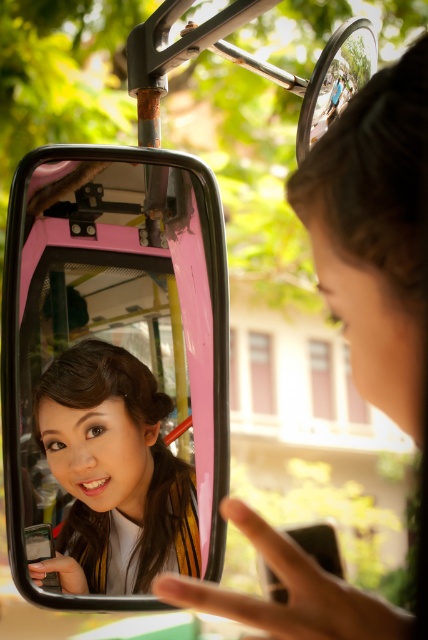
Does pink glossy rearview mirror at upper center have a lesser height compared to matte black hair at center?

No, pink glossy rearview mirror at upper center is not shorter than matte black hair at center.

Is pink glossy rearview mirror at upper center smaller than matte black hair at center?

No, pink glossy rearview mirror at upper center is not smaller than matte black hair at center.

Is point (130, 548) positioned after point (104, 385)?

Yes, it is behind point (104, 385).

Find the location of a particular element. pink glossy rearview mirror at upper center is located at coordinates (112, 372).

Does pink glossy rearview mirror at upper center come behind matte black phone at center?

Yes, pink glossy rearview mirror at upper center is further from the viewer.

Is pink glossy rearview mirror at upper center below matte black phone at center?

Yes.

This screenshot has height=640, width=428. What do you see at coordinates (112, 372) in the screenshot?
I see `pink glossy rearview mirror at upper center` at bounding box center [112, 372].

The image size is (428, 640). In order to click on pink glossy rearview mirror at upper center in this screenshot , I will do `click(112, 372)`.

Who is taller, matte black phone at center or matte black hair at center?

matte black phone at center is taller.

Which is below, matte black phone at center or matte black hair at center?

Positioned lower is matte black hair at center.

Is point (386, 173) positioned after point (115, 397)?

No, (386, 173) is in front of (115, 397).

The height and width of the screenshot is (640, 428). What are the coordinates of `matte black phone at center` in the screenshot? It's located at (356, 340).